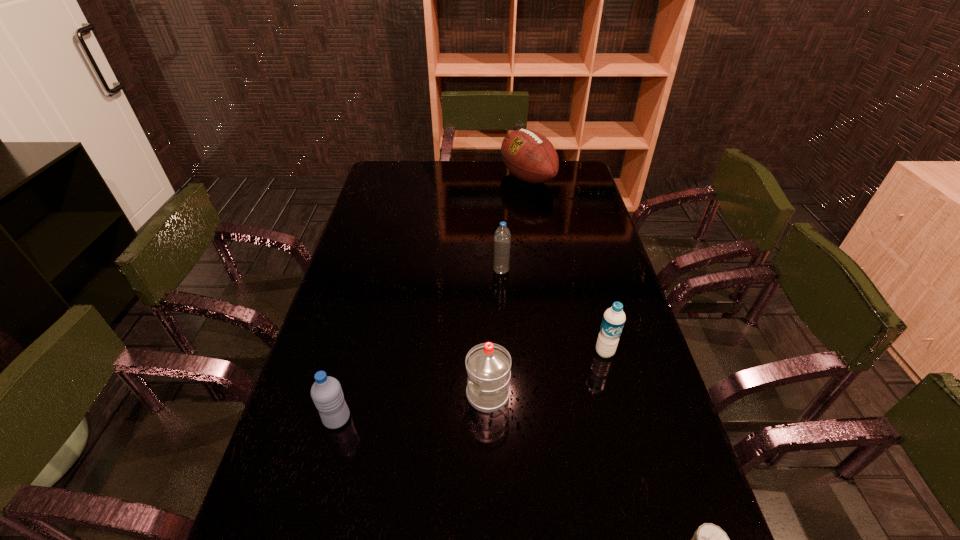
At what (x,y) coordinates should I click in order to perform the action: click on object at the left edge. Please return your answer as a coordinate pair (x, y). Looking at the image, I should click on (326, 392).

Identify the location of football (American) that is at the right edge. (529, 156).

Locate an element on the screen. This screenshot has width=960, height=540. water bottle that is positioned at the right edge is located at coordinates (614, 318).

In order to click on object at the far right corner in this screenshot , I will do (529, 156).

Identify the location of free space at the far edge of the desktop. (487, 176).

In the image, there is a desktop. Find the location of `free space at the left edge`. free space at the left edge is located at coordinates (296, 437).

You are a GUI agent. You are given a task and a screenshot of the screen. Output one action in this format:
    pyautogui.click(x=<x>, y=<y>)
    Task: Click on the vacant area at the right edge of the desktop
    
    Given the screenshot: What is the action you would take?
    pyautogui.click(x=662, y=429)

In order to click on blank space at the far left corner of the desktop in this screenshot , I will do `click(379, 173)`.

At what (x,y) coordinates should I click in order to perform the action: click on vacant space at the far right corner. Please return your answer as a coordinate pair (x, y). This screenshot has width=960, height=540. Looking at the image, I should click on (580, 179).

In order to click on free space between the third nearest water bottle and the second farthest object in this screenshot , I will do `click(553, 312)`.